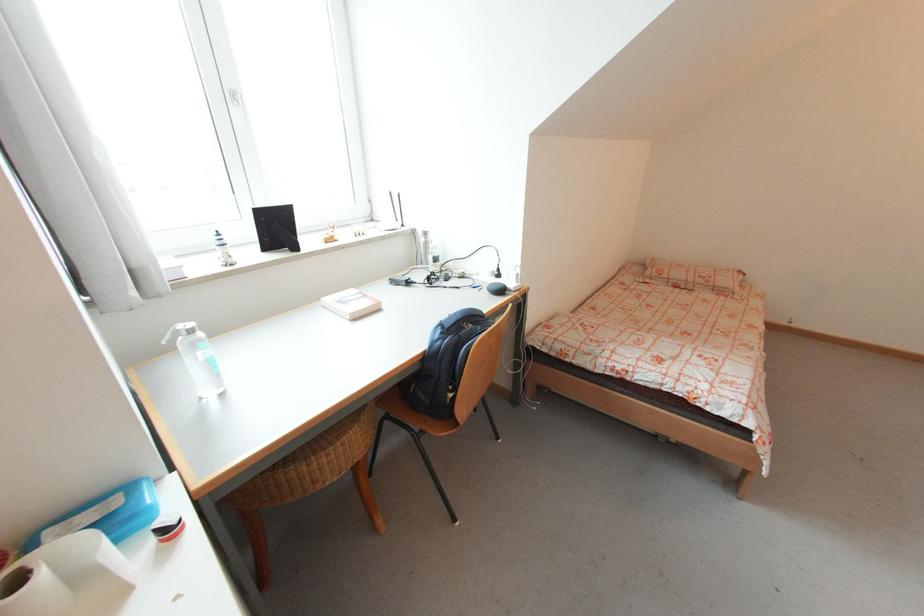
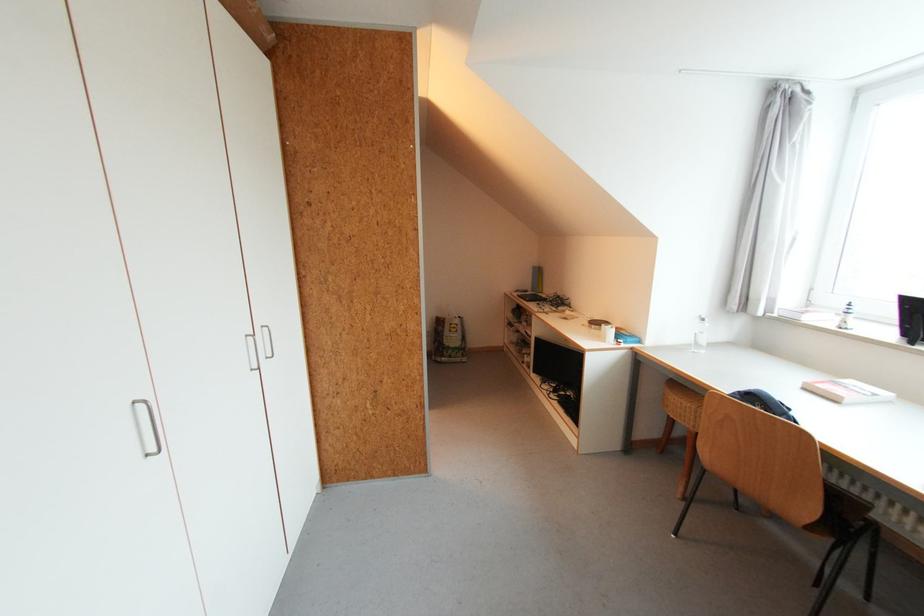
The point at (237, 265) is marked in the first image. Where is the corresponding point in the second image?

(845, 329)